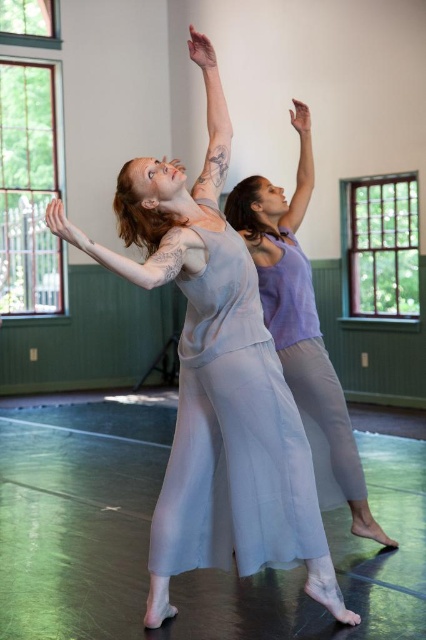
Is matte lavender dress at center bigger than matte gray arm at upper left?

Indeed, matte lavender dress at center has a larger size compared to matte gray arm at upper left.

Is matte lavender dress at center positioned in front of matte gray arm at upper left?

No, it is behind matte gray arm at upper left.

In order to click on matte lavender dress at center in this screenshot , I will do `click(301, 316)`.

Where is `matte lavender dress at center`? The width and height of the screenshot is (426, 640). matte lavender dress at center is located at coordinates (301, 316).

Does matte gray dress at center come in front of matte lavender dress at center?

That is True.

Which is in front, point (238, 508) or point (302, 328)?

Point (238, 508) is more forward.

In the scene shown: Who is more forward, (170, 172) or (359, 531)?

Point (170, 172) is more forward.

This screenshot has height=640, width=426. I want to click on matte gray dress at center, so click(x=216, y=396).

Who is taller, matte lavender dress at center or matte gray arm at upper center?

matte lavender dress at center is taller.

Is point (310, 344) closer to camera compared to point (210, 88)?

No, it is behind (210, 88).

Find the location of `matte lavender dress at center`. matte lavender dress at center is located at coordinates (301, 316).